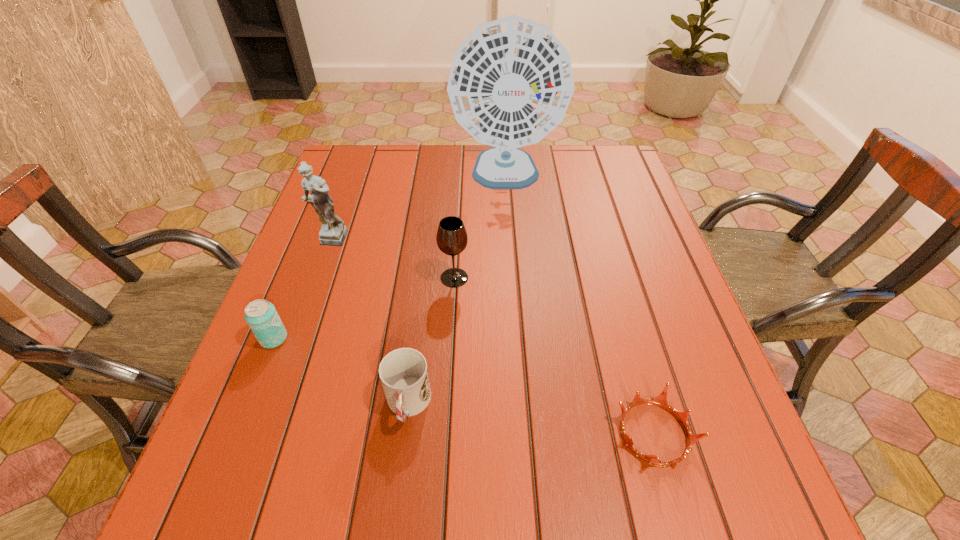
The width and height of the screenshot is (960, 540). Identify the location of free space in the image that satisfies the following two spatial constraints: 1. on the handle side of the cup; 2. on the right side of the shortest object. (404, 434).

The width and height of the screenshot is (960, 540). I want to click on free point that satisfies the following two spatial constraints: 1. on the grille of the crown; 2. on the left side of the tallest object, so click(x=524, y=434).